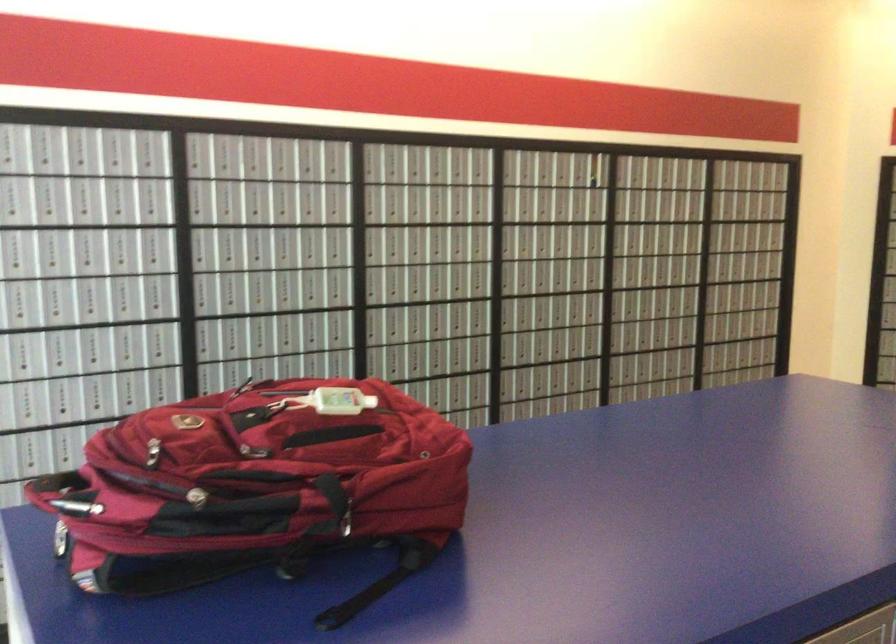
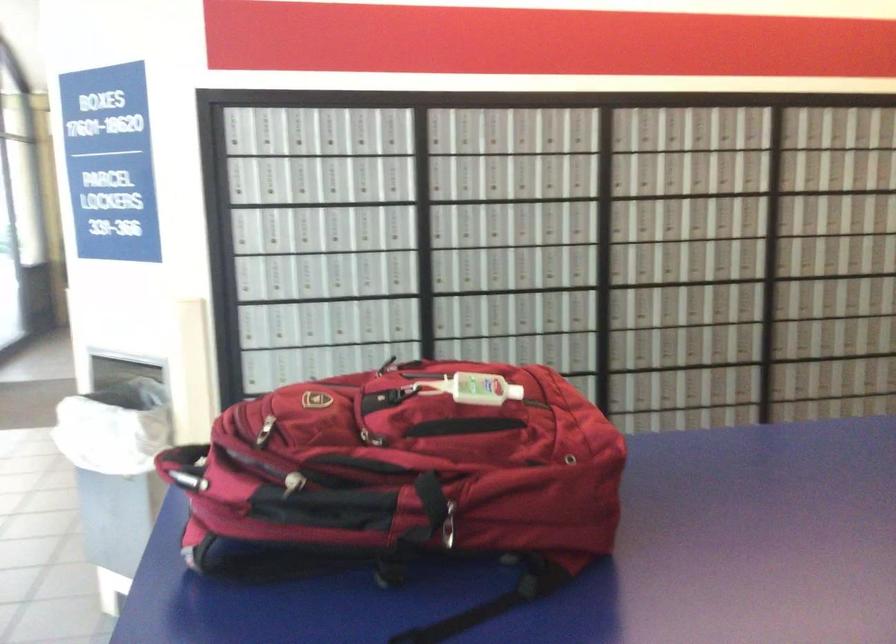
Where in the second image is the point corresponding to pixel 355 515 from the first image?

(446, 524)